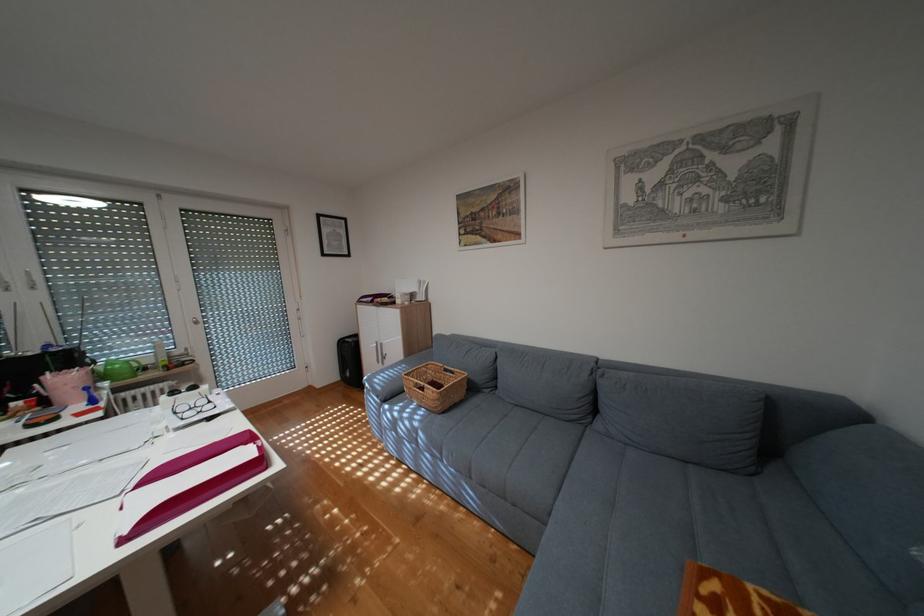
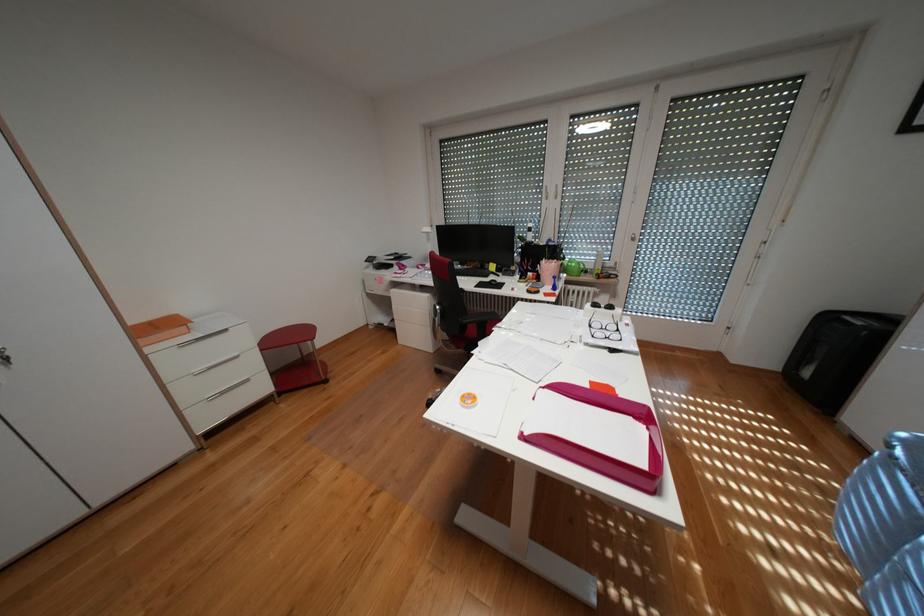
Where in the second image is the point corresponding to (x=187, y=411) from the first image?

(602, 325)